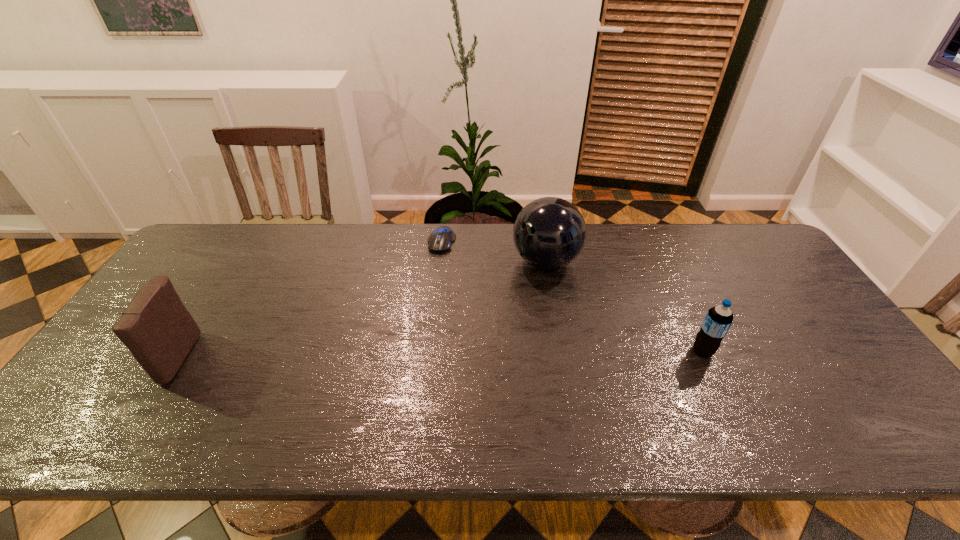
The height and width of the screenshot is (540, 960). Identify the location of vacant space at the far edge of the desktop. (637, 223).

Locate an element on the screen. The height and width of the screenshot is (540, 960). vacant area at the near edge is located at coordinates (507, 393).

You are a GUI agent. You are given a task and a screenshot of the screen. Output one action in this format:
    pyautogui.click(x=<x>, y=<y>)
    Task: Click on the free space at the right edge
    This screenshot has height=540, width=960.
    Given the screenshot: What is the action you would take?
    (805, 295)

This screenshot has width=960, height=540. What are the coordinates of `unoccupied position between the rightmost object and the bowling ball` in the screenshot? It's located at (624, 306).

The height and width of the screenshot is (540, 960). Find the location of `empty location between the shortest object and the rightmost object`. empty location between the shortest object and the rightmost object is located at coordinates (572, 296).

Image resolution: width=960 pixels, height=540 pixels. I want to click on empty location between the computer mouse and the pouch, so 308,300.

The width and height of the screenshot is (960, 540). I want to click on vacant area between the leftmost object and the computer mouse, so click(308, 300).

The width and height of the screenshot is (960, 540). What are the coordinates of `unoccupied position between the bowling ball and the pouch` in the screenshot? It's located at pyautogui.click(x=360, y=309).

This screenshot has height=540, width=960. Identify the location of blank region between the soda bottle and the leftmost object. (439, 354).

Where is `unoccupied area between the leftmost object and the shortest object`? The image size is (960, 540). unoccupied area between the leftmost object and the shortest object is located at coordinates (308, 300).